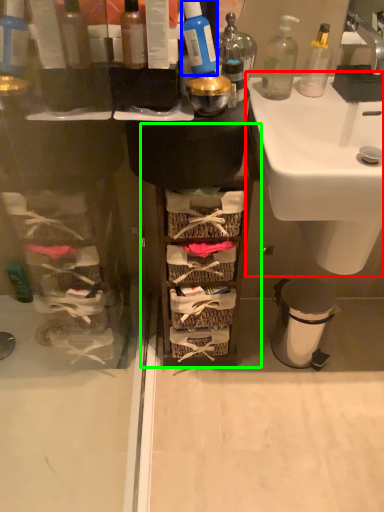
Question: Based on their relative distances, which object is nearer to sink (highlighted by a red box)? Choose from cleaning product (highlighted by a blue box) and cabinetry (highlighted by a green box).

Choices:
 (A) cleaning product
 (B) cabinetry

Answer: (B)